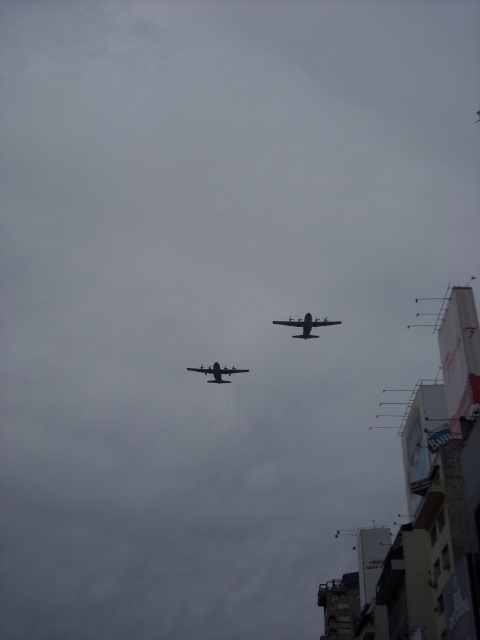
Question: Which of the following is the closest to the observer?

Choices:
 (A) (225, 368)
 (B) (309, 336)

Answer: (B)

Question: Which point is farther to the camera?

Choices:
 (A) (312, 324)
 (B) (207, 372)

Answer: (B)

Question: Is matte black airplane at upper center closer to camera compared to metallic gray airplane at center?

Choices:
 (A) yes
 (B) no

Answer: (A)

Question: Which point is farther from the camera taking this photo?

Choices:
 (A) pyautogui.click(x=340, y=323)
 (B) pyautogui.click(x=212, y=372)

Answer: (A)

Question: Does matte black airplane at upper center have a lesser width compared to metallic gray airplane at center?

Choices:
 (A) yes
 (B) no

Answer: (B)

Question: Does matte black airplane at upper center have a greater width compared to metallic gray airplane at center?

Choices:
 (A) yes
 (B) no

Answer: (A)